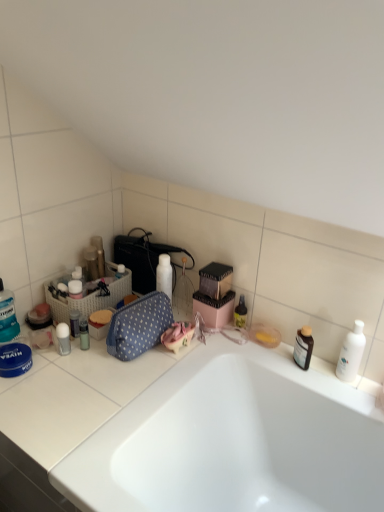
Question: Should I look upward or downward to see white glossy bottle at center, which is the fourth toiletry in right-to-left order?

Choices:
 (A) up
 (B) down

Answer: (B)

Question: Does blue polka dot fabric bag at center have a larger size compared to translucent plastic tube at left, which appears as the 8th toiletry when viewed from the right?

Choices:
 (A) no
 (B) yes

Answer: (B)

Question: Does blue polka dot fabric bag at center appear on the right side of translucent plastic tube at left, which appears as the 8th toiletry when viewed from the right?

Choices:
 (A) no
 (B) yes

Answer: (B)

Question: Does blue polka dot fabric bag at center have a lesser height compared to translucent plastic tube at left, the 3th toiletry in the left-to-right sequence?

Choices:
 (A) no
 (B) yes

Answer: (A)

Question: Is blue polka dot fabric bag at center at the left side of translucent plastic tube at left, which appears as the 8th toiletry when viewed from the right?

Choices:
 (A) yes
 (B) no

Answer: (B)

Question: Is blue polka dot fabric bag at center thinner than translucent plastic tube at left, the 3th toiletry in the left-to-right sequence?

Choices:
 (A) yes
 (B) no

Answer: (B)

Question: From a real-world perspective, is blue polka dot fabric bag at center beneath translucent plastic tube at left, which appears as the 8th toiletry when viewed from the right?

Choices:
 (A) yes
 (B) no

Answer: (B)

Question: From a real-world perspective, is white glossy bottle at center, which is the fourth toiletry in right-to-left order, positioned over white glossy bathtub at lower left based on gravity?

Choices:
 (A) no
 (B) yes

Answer: (B)

Question: From the image's perspective, would you say white glossy bottle at center, which is the fourth toiletry in right-to-left order, is positioned over white glossy bathtub at lower left?

Choices:
 (A) no
 (B) yes

Answer: (B)

Question: Can you confirm if white glossy bottle at center, which is the fourth toiletry in right-to-left order, is smaller than white glossy bathtub at lower left?

Choices:
 (A) no
 (B) yes

Answer: (B)

Question: Is white glossy bottle at center, which is the fourth toiletry in right-to-left order, further to camera compared to white glossy bathtub at lower left?

Choices:
 (A) yes
 (B) no

Answer: (A)

Question: Is white glossy bottle at center, which is the fourth toiletry in right-to-left order, turned away from white glossy bathtub at lower left?

Choices:
 (A) yes
 (B) no

Answer: (B)

Question: Does white glossy bottle at center, which is the fourth toiletry in right-to-left order, have a larger size compared to white glossy bathtub at lower left?

Choices:
 (A) no
 (B) yes

Answer: (A)

Question: Does blue polka dot fabric bag at center have a lesser height compared to white woven laundry basket at left?

Choices:
 (A) no
 (B) yes

Answer: (A)